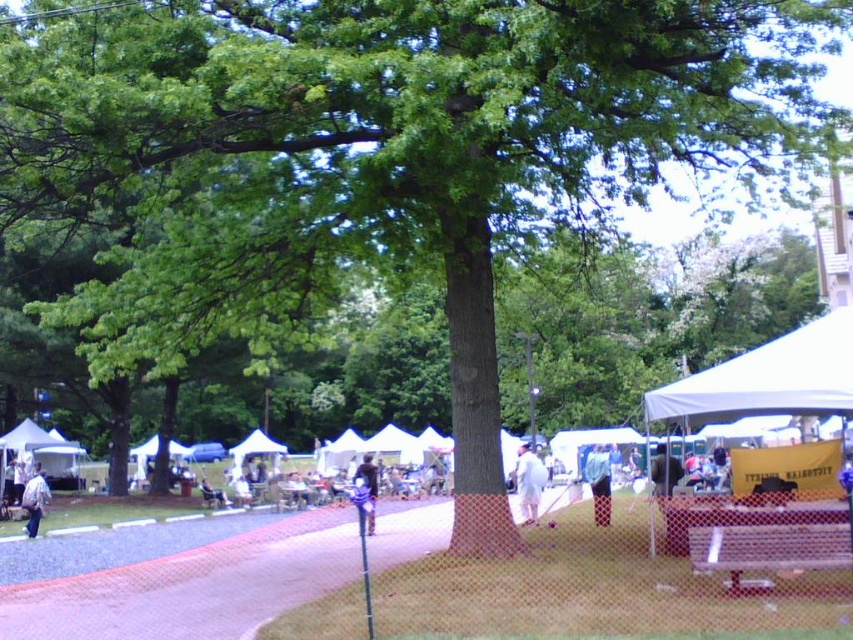
Question: Can you confirm if white fabric at center is positioned to the left of light blue denim jacket at lower left?

Choices:
 (A) yes
 (B) no

Answer: (B)

Question: Which of the following is the farthest from the observer?

Choices:
 (A) denim jacket at center
 (B) blue denim jeans at center
 (C) light blue denim jacket at lower left

Answer: (C)

Question: Is white canvas tent at lower left smaller than denim jacket at center?

Choices:
 (A) yes
 (B) no

Answer: (A)

Question: Observing the image, what is the correct spatial positioning of white canvas tent at lower left in reference to white fabric at center?

Choices:
 (A) left
 (B) right

Answer: (A)

Question: Which point appears farthest from the camera in this image?

Choices:
 (A) (18, 499)
 (B) (830, 320)
 (C) (537, 484)

Answer: (A)

Question: Which point is closer to the camera taking this photo?

Choices:
 (A) (42, 461)
 (B) (674, 472)

Answer: (B)